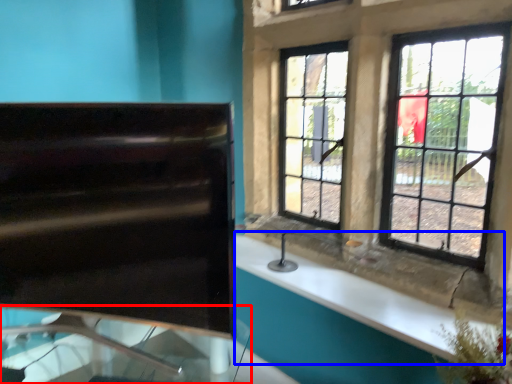
Question: Which object appears farthest to the camera in this image, glass table (highlighted by a red box) or counter top (highlighted by a blue box)?

Choices:
 (A) glass table
 (B) counter top

Answer: (B)